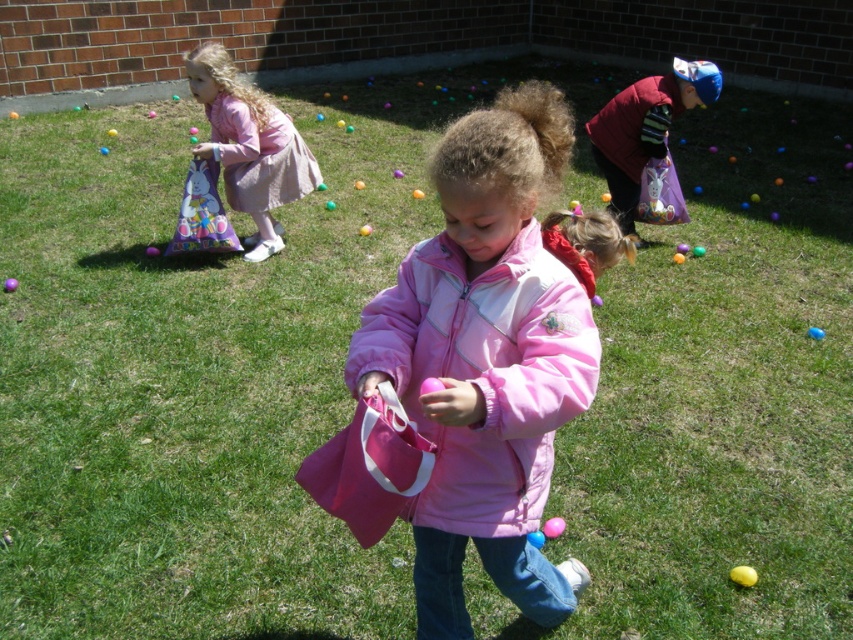
Question: Which object is closer to the camera taking this photo?

Choices:
 (A) purple matte egg at center
 (B) pink fabric bag at upper left
 (C) smooth plastic egg at center
 (D) yellow rubber ball at lower right

Answer: (D)

Question: Considering the real-world distances, which object is farthest from the yellow rubber ball at lower right?

Choices:
 (A) velvet purple vest at upper right
 (B) pink matte jacket at center
 (C) pink fabric bag at upper left
 (D) purple matte egg at center

Answer: (D)

Question: Considering the relative positions of pink fabric bag at center and smooth plastic egg at center in the image provided, where is pink fabric bag at center located with respect to smooth plastic egg at center?

Choices:
 (A) left
 (B) right

Answer: (A)

Question: Does pink matte jacket at center have a smaller size compared to pink fabric bag at upper left?

Choices:
 (A) no
 (B) yes

Answer: (A)

Question: Does pink fabric bag at upper left have a lesser width compared to velvet purple vest at upper right?

Choices:
 (A) no
 (B) yes

Answer: (B)

Question: Which object is farther from the camera taking this photo?

Choices:
 (A) velvet purple vest at upper right
 (B) pink fabric bag at center

Answer: (A)